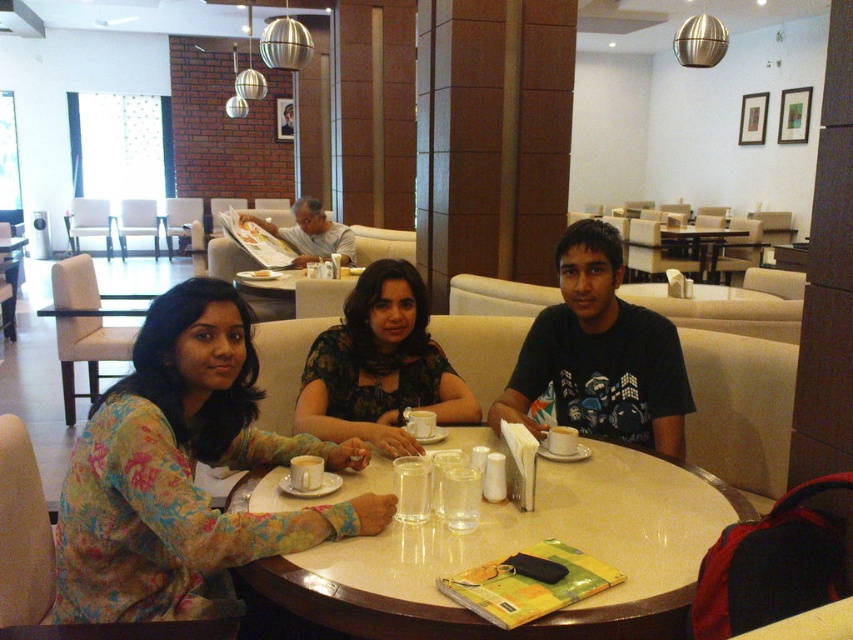
You are a photographer positioned at the center of the room. You need to capture a photo of the floral fabric dress at center. According to the coordinates provided, where should you aim your camera to ensure the dress is centered in the frame?

The floral fabric dress at center is located at coordinates point (380, 365), so you should aim your camera towards that point to center it in the frame.